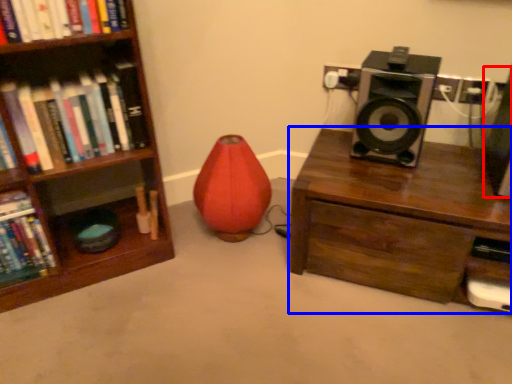
Question: Which of the following is the closest to the observer, speaker (highlighted by a red box) or desk (highlighted by a blue box)?

Choices:
 (A) speaker
 (B) desk

Answer: (A)